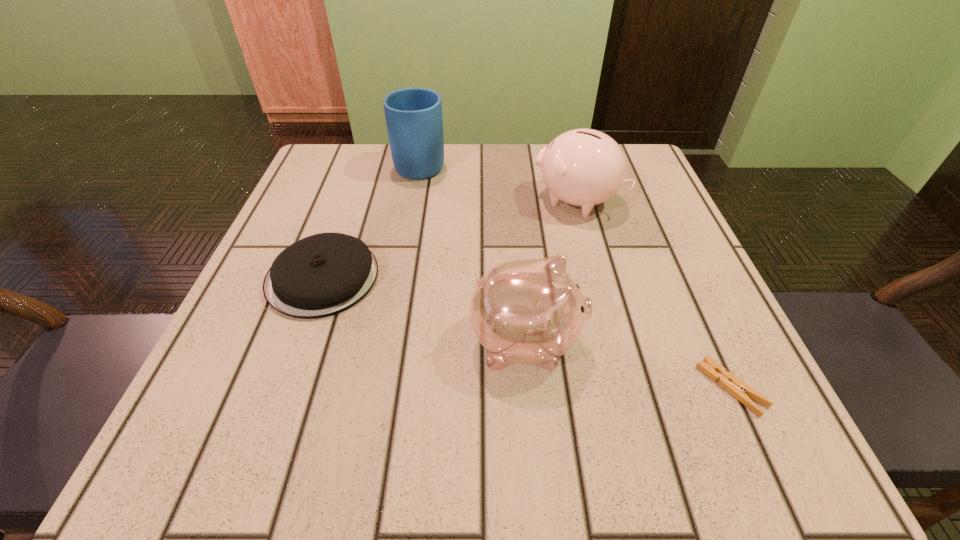
Identify the location of vacant point located between the clothespin and the nearer piggy bank. The width and height of the screenshot is (960, 540). (629, 365).

Identify the location of object that can be found as the closest to the fourth tallest object. The width and height of the screenshot is (960, 540). (530, 311).

This screenshot has width=960, height=540. I want to click on the closest object to the pancake, so click(x=530, y=311).

Locate an element on the screen. The image size is (960, 540). vacant space that satisfies the following two spatial constraints: 1. on the front facing side of the farther piggy bank; 2. on the right side of the nearer piggy bank is located at coordinates (514, 200).

Locate an element on the screen. The image size is (960, 540). vacant space that satisfies the following two spatial constraints: 1. on the front facing side of the nearer piggy bank; 2. on the right side of the farther piggy bank is located at coordinates (514, 200).

Where is `vacant space that satisfies the following two spatial constraints: 1. on the front facing side of the nearer piggy bank; 2. on the front side of the pancake`? Image resolution: width=960 pixels, height=540 pixels. vacant space that satisfies the following two spatial constraints: 1. on the front facing side of the nearer piggy bank; 2. on the front side of the pancake is located at coordinates (520, 278).